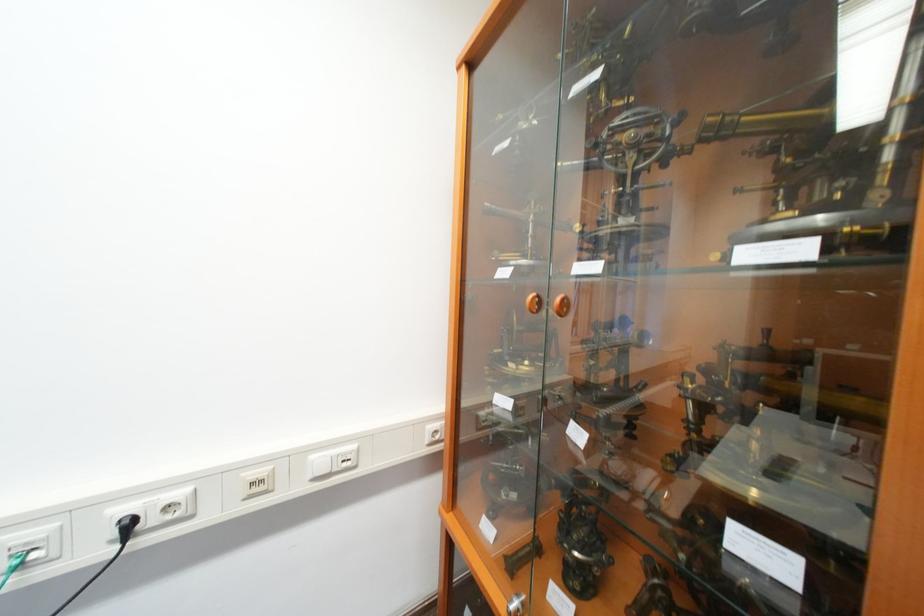
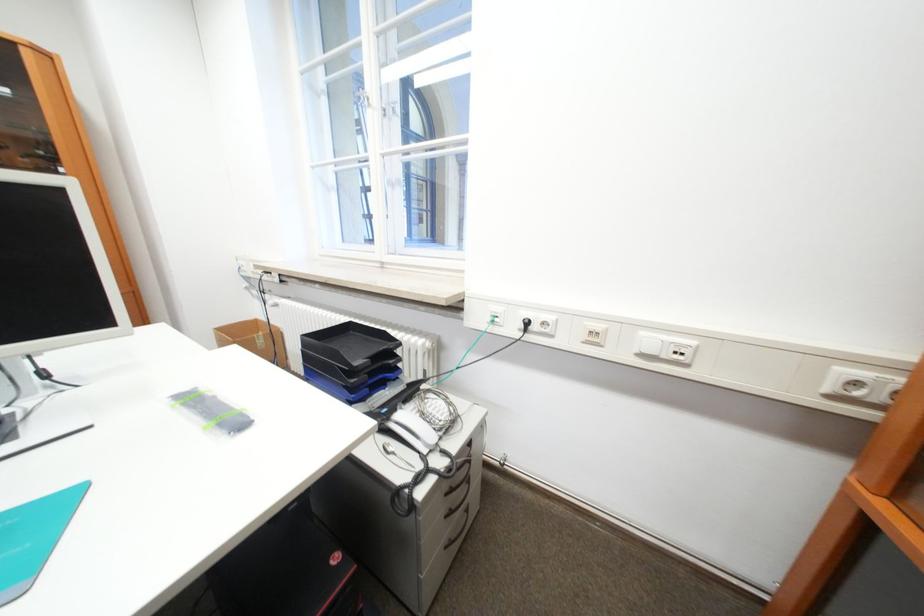
Question: The images are taken continuously from a first-person perspective. In which direction is your viewpoint rotating?

Choices:
 (A) Left
 (B) Right
 (C) Up
 (D) Down

Answer: (A)